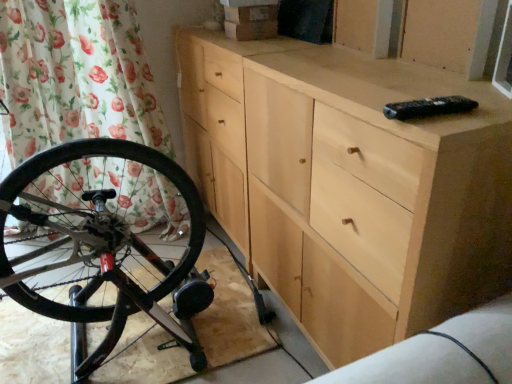
What do you see at coordinates (349, 185) in the screenshot? I see `natural wood chest of drawers at center` at bounding box center [349, 185].

Find the location of a particular element. clear glass window screen at upper right is located at coordinates (504, 57).

What is the approximate height of clear glass window screen at upper right?

The height of clear glass window screen at upper right is 17.38 centimeters.

Find the location of `floral fabric curtain at left`. floral fabric curtain at left is located at coordinates pos(76,76).

Based on the photo, who is bigger, floral fabric curtain at left or natural wood chest of drawers at center?

natural wood chest of drawers at center.

Is floral fabric curtain at left far away from natural wood chest of drawers at center?

Actually, floral fabric curtain at left and natural wood chest of drawers at center are a little close together.

In the image, is floral fabric curtain at left on the left side or the right side of natural wood chest of drawers at center?

Based on their positions, floral fabric curtain at left is located to the left of natural wood chest of drawers at center.

Measure the distance from floral fabric curtain at left to natural wood chest of drawers at center.

floral fabric curtain at left is 30.89 inches from natural wood chest of drawers at center.

From the picture: From the image's perspective, relative to natural wood chest of drawers at center, is clear glass window screen at upper right above or below?

Clearly, from the image's perspective, clear glass window screen at upper right is above natural wood chest of drawers at center.

Looking at this image, considering the positions of objects clear glass window screen at upper right and natural wood chest of drawers at center in the image provided, who is behind, clear glass window screen at upper right or natural wood chest of drawers at center?

clear glass window screen at upper right is behind.

From a real-world perspective, which is physically above, clear glass window screen at upper right or natural wood chest of drawers at center?

clear glass window screen at upper right.

Considering the relative sizes of clear glass window screen at upper right and natural wood chest of drawers at center in the image provided, is clear glass window screen at upper right shorter than natural wood chest of drawers at center?

Indeed, clear glass window screen at upper right has a lesser height compared to natural wood chest of drawers at center.

Considering the relative positions of floral fabric curtain at left and clear glass window screen at upper right in the image provided, is floral fabric curtain at left to the left or to the right of clear glass window screen at upper right?

Based on their positions, floral fabric curtain at left is located to the left of clear glass window screen at upper right.

Is floral fabric curtain at left taller or shorter than clear glass window screen at upper right?

floral fabric curtain at left is taller than clear glass window screen at upper right.

In terms of width, does floral fabric curtain at left look wider or thinner when compared to clear glass window screen at upper right?

Considering their sizes, floral fabric curtain at left looks broader than clear glass window screen at upper right.

How different are the orientations of natural wood chest of drawers at center and floral fabric curtain at left in degrees?

They differ by 88.7 degrees in their facing directions.

From the image's perspective, is natural wood chest of drawers at center positioned above or below floral fabric curtain at left?

natural wood chest of drawers at center is below floral fabric curtain at left.

Which of these two, natural wood chest of drawers at center or floral fabric curtain at left, is thinner?

With smaller width is floral fabric curtain at left.

Is floral fabric curtain at left surrounded by natural wood chest of drawers at center?

Actually, floral fabric curtain at left is outside natural wood chest of drawers at center.

Does clear glass window screen at upper right turn towards floral fabric curtain at left?

No, clear glass window screen at upper right is not oriented towards floral fabric curtain at left.

Is clear glass window screen at upper right in contact with floral fabric curtain at left?

clear glass window screen at upper right is not next to floral fabric curtain at left, and they're not touching.

Does clear glass window screen at upper right have a lesser height compared to floral fabric curtain at left?

Indeed, clear glass window screen at upper right has a lesser height compared to floral fabric curtain at left.

Is clear glass window screen at upper right located outside floral fabric curtain at left?

Absolutely, clear glass window screen at upper right is external to floral fabric curtain at left.

Considering the sizes of objects natural wood chest of drawers at center and clear glass window screen at upper right in the image provided, who is smaller, natural wood chest of drawers at center or clear glass window screen at upper right?

Smaller between the two is clear glass window screen at upper right.

From the picture: Is natural wood chest of drawers at center not near clear glass window screen at upper right?

They are positioned close to each other.

Does natural wood chest of drawers at center have a lesser height compared to clear glass window screen at upper right?

Incorrect, the height of natural wood chest of drawers at center does not fall short of that of clear glass window screen at upper right.

Is point (313, 213) farther from camera compared to point (510, 46)?

Yes, it is.

This screenshot has height=384, width=512. In the image, there is a natural wood chest of drawers at center. Identify the location of shower curtain above it (from the image's perspective). (x=76, y=76).

The height and width of the screenshot is (384, 512). Identify the location of the chest of drawers beneath the clear glass window screen at upper right (from a real-world perspective). [x=349, y=185].

Which object lies further to the anchor point clear glass window screen at upper right, floral fabric curtain at left or natural wood chest of drawers at center?

Among the two, floral fabric curtain at left is located further to clear glass window screen at upper right.

When comparing their distances from natural wood chest of drawers at center, does floral fabric curtain at left or clear glass window screen at upper right seem closer?

clear glass window screen at upper right is closer to natural wood chest of drawers at center.

Looking at the image, which one is located closer to clear glass window screen at upper right, natural wood chest of drawers at center or floral fabric curtain at left?

The object closer to clear glass window screen at upper right is natural wood chest of drawers at center.

Considering their positions, is clear glass window screen at upper right positioned closer to natural wood chest of drawers at center than floral fabric curtain at left?

The object closer to natural wood chest of drawers at center is clear glass window screen at upper right.

Looking at the image, which one is located further to floral fabric curtain at left, clear glass window screen at upper right or natural wood chest of drawers at center?

clear glass window screen at upper right is positioned further to the anchor floral fabric curtain at left.

Based on the photo, which object lies further to the anchor point floral fabric curtain at left, natural wood chest of drawers at center or clear glass window screen at upper right?

clear glass window screen at upper right is positioned further to the anchor floral fabric curtain at left.

Locate an element on the screen. the chest of drawers located between floral fabric curtain at left and clear glass window screen at upper right in the left-right direction is located at coordinates pyautogui.click(x=349, y=185).